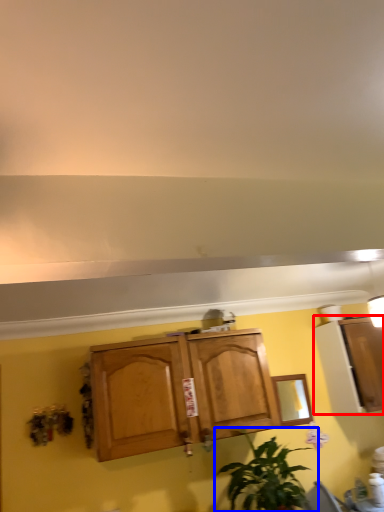
Question: Among these objects, which one is farthest to the camera, cabinetry (highlighted by a red box) or houseplant (highlighted by a blue box)?

Choices:
 (A) cabinetry
 (B) houseplant

Answer: (A)